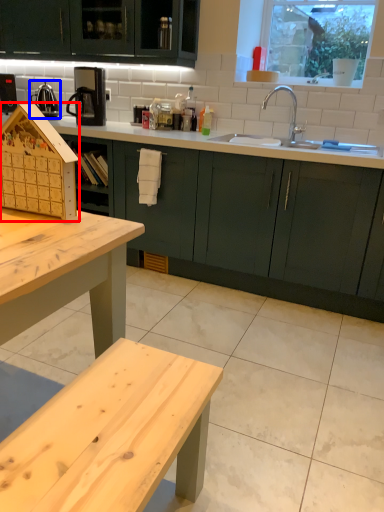
Question: Which object is further to the camera taking this photo, appliance (highlighted by a red box) or tea pot (highlighted by a blue box)?

Choices:
 (A) appliance
 (B) tea pot

Answer: (B)